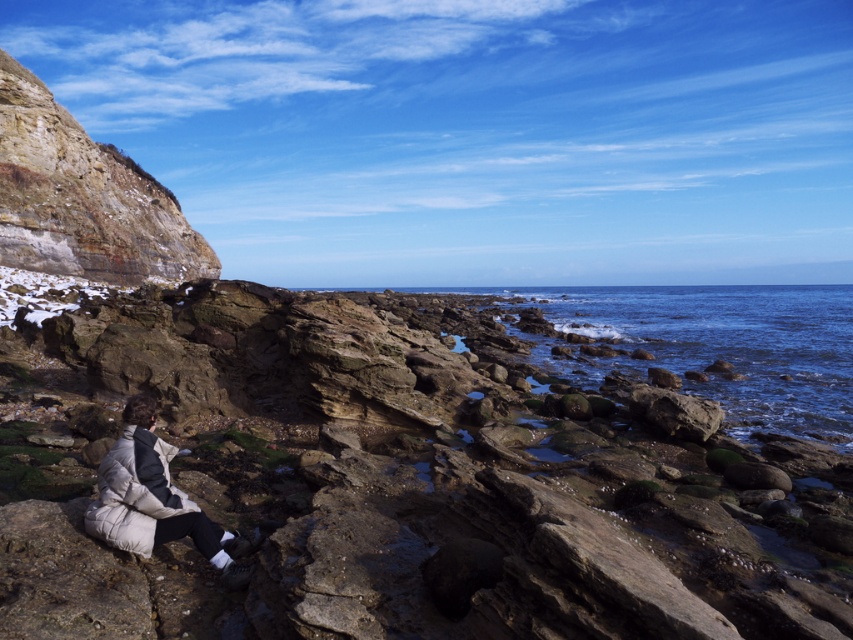
Does point (73, 221) come closer to viewer compared to point (160, 515)?

No, it is behind (160, 515).

Who is more distant from viewer, (73, 253) or (114, 461)?

The point (73, 253) is behind.

Which is behind, point (183, 221) or point (215, 545)?

The point (183, 221) is behind.

Where is `rustic stone cliff at upper left`? rustic stone cliff at upper left is located at coordinates (82, 198).